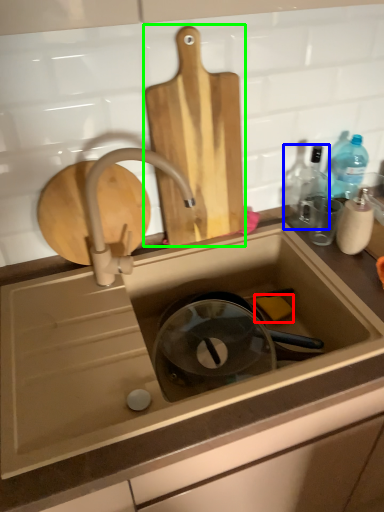
Question: Which object is positioned farthest from soap (highlighted by a red box)? Select from bottle (highlighted by a blue box) and cutting board (highlighted by a green box).

Choices:
 (A) bottle
 (B) cutting board

Answer: (B)